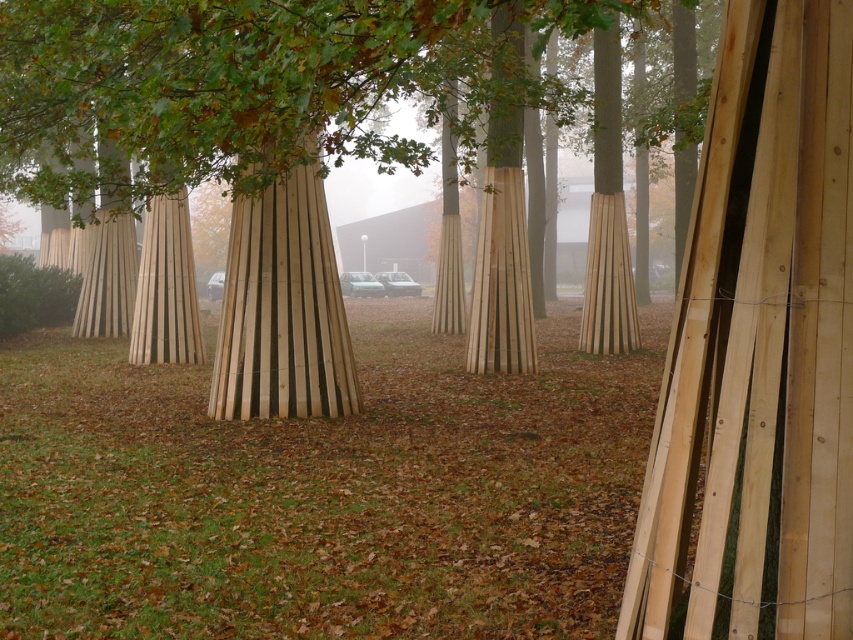
Is natural wood tree at center positioned at the back of natural wood pillar at center?

No, natural wood tree at center is in front of natural wood pillar at center.

Does natural wood tree at center have a larger size compared to natural wood pillar at center?

Yes.

This screenshot has width=853, height=640. What do you see at coordinates (260, 83) in the screenshot?
I see `natural wood tree at center` at bounding box center [260, 83].

Locate an element on the screen. natural wood tree at center is located at coordinates (260, 83).